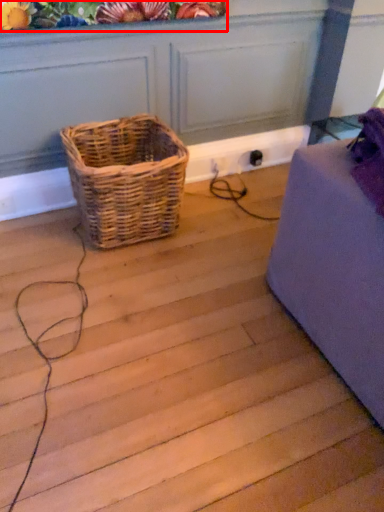
Question: Considering the relative positions of floral arrangement (annotated by the red box) and picnic basket in the image provided, where is floral arrangement (annotated by the red box) located with respect to the staircase?

Choices:
 (A) right
 (B) left

Answer: (A)